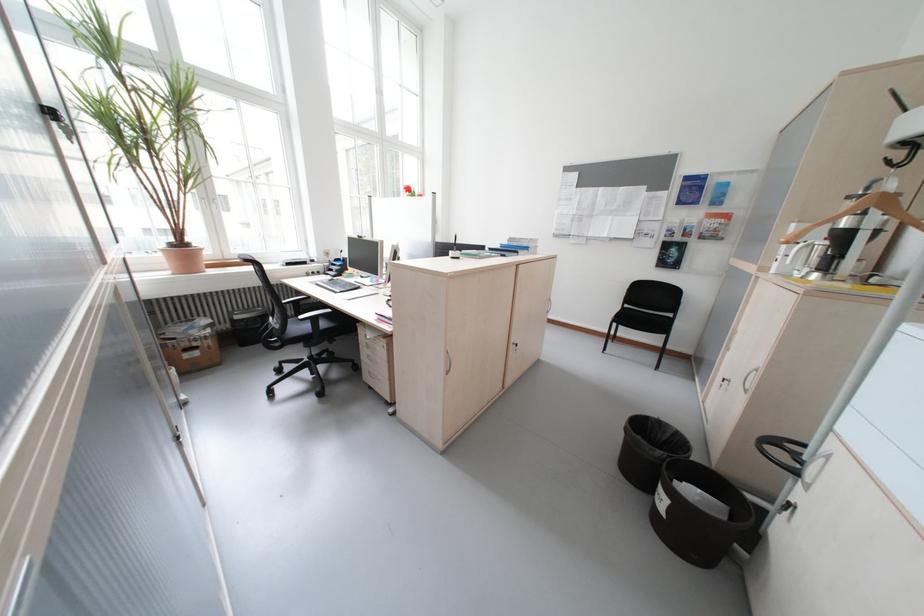
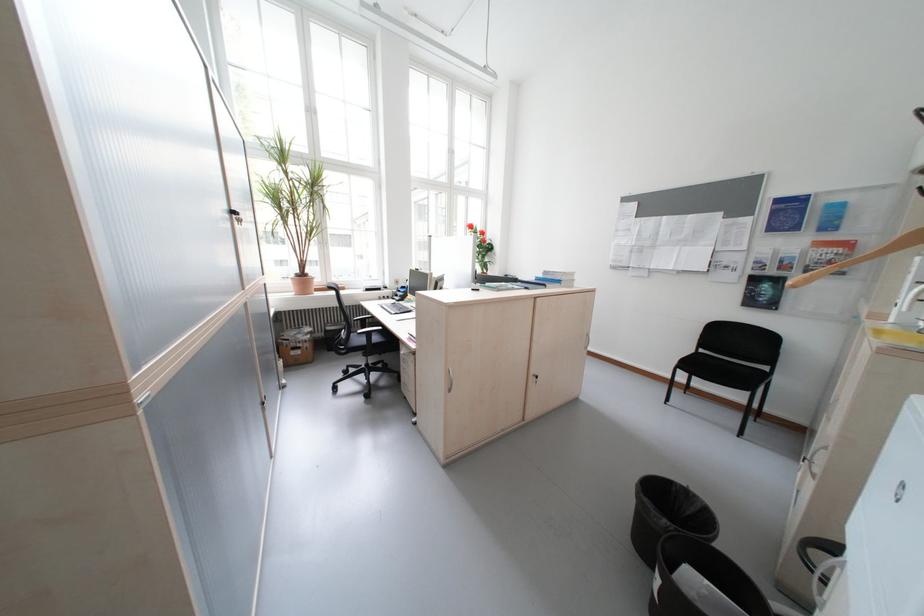
Where in the second image is the point corresponding to [650,439] from the first image?

(655, 501)